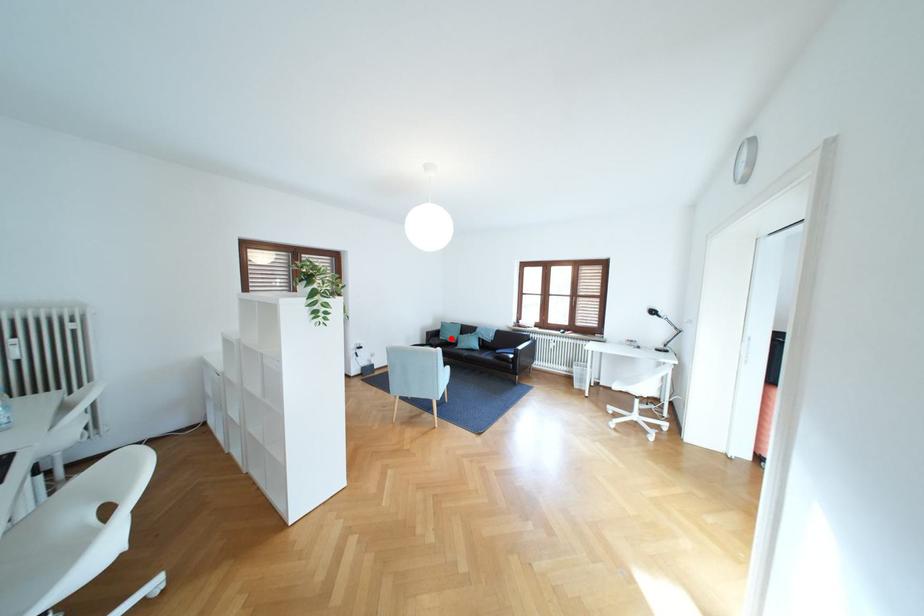
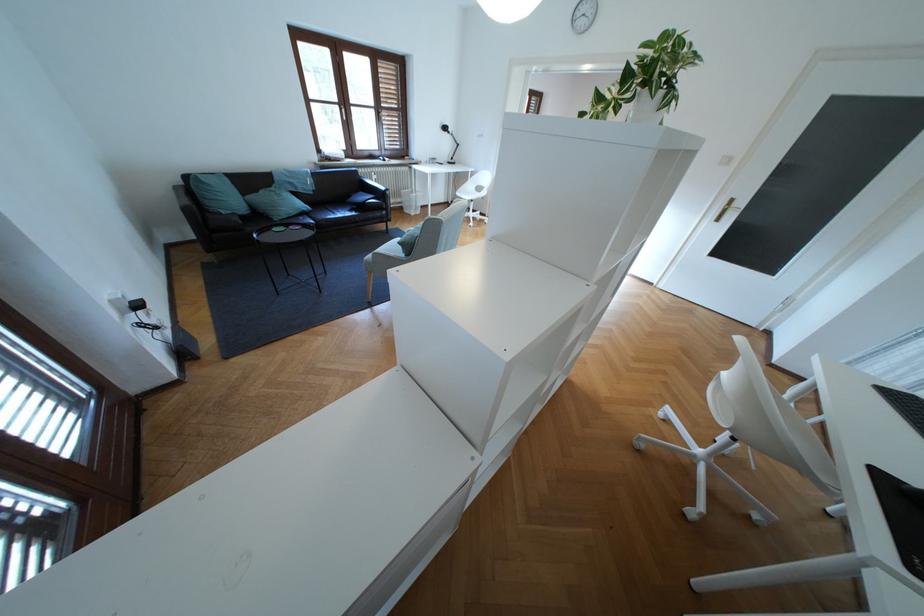
Question: I am providing you with two images of the same scene from different viewpoints. In image1, a red point is highlighted. Considering the same 3D point in image2, which of the following is correct?

Choices:
 (A) It is closer
 (B) It is farther

Answer: (A)